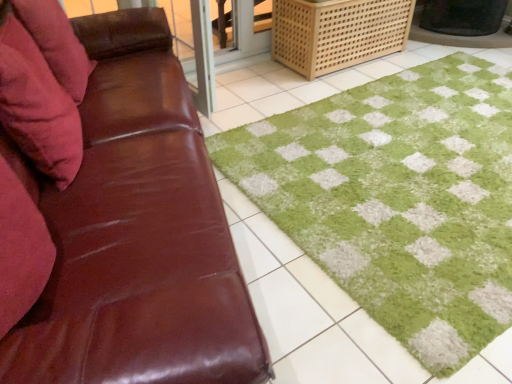
Question: In the image, is light brown woven crate at upper right on the left side or the right side of green shaggy bath mat at center?

Choices:
 (A) left
 (B) right

Answer: (A)

Question: From a real-world perspective, is light brown woven crate at upper right physically located above or below green shaggy bath mat at center?

Choices:
 (A) below
 (B) above

Answer: (B)

Question: Based on their relative distances, which object is farther from the brown leather couch at left?

Choices:
 (A) green shaggy bath mat at center
 (B) light brown woven crate at upper right
 (C) velvet red pillow at left, which is counted as the second pillow, starting from the back
 (D) velvety pink pillow at left, which is counted as the 1th pillow, starting from the back

Answer: (B)

Question: Which object is positioned closest to the light brown woven crate at upper right?

Choices:
 (A) brown leather couch at left
 (B) velvet red pillow at left, arranged as the first pillow when viewed from the front
 (C) velvety pink pillow at left, which ranks as the second pillow in front-to-back order
 (D) green shaggy bath mat at center

Answer: (D)